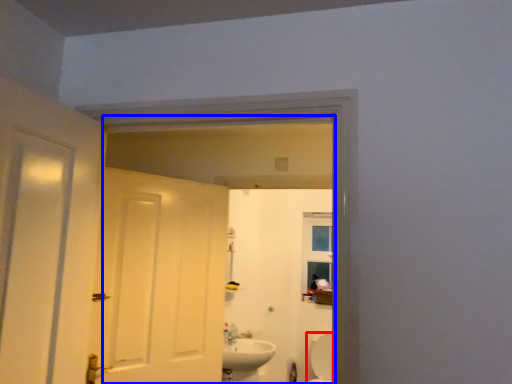
Question: Which of the following is the closest to the observer, bath (highlighted by a red box) or mirror (highlighted by a blue box)?

Choices:
 (A) bath
 (B) mirror

Answer: (B)